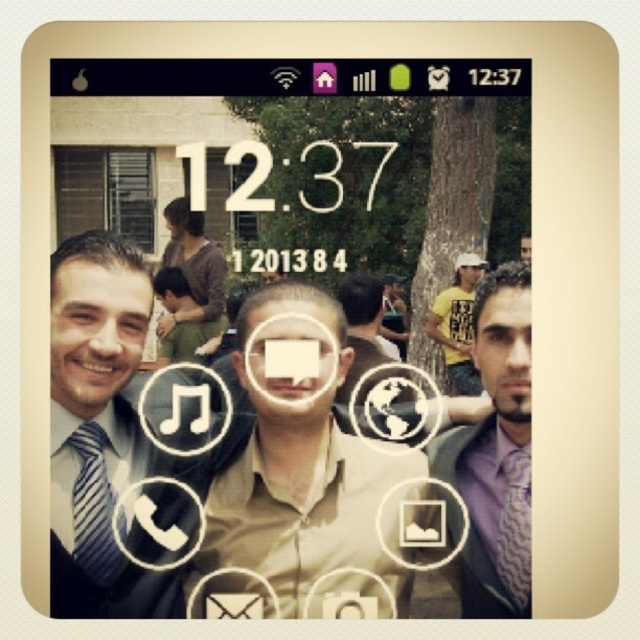
You are designing a digital collage and need to adjust the layout so that the smooth skin face at center is the same height as the matte black face at left. Which face should you enlarge or shrink, and by what percentage?

The smooth skin face at center is shorter than the matte black face at left. To make them the same height, you should enlarge the smooth skin face at center by the percentage difference between their heights. However, the exact percentage cannot be calculated without knowing the current height measurements.

You are a photographer trying to capture a closeup of the purple silk shirt at right and the matte black face at left in the smartphone screen image. Based on their sizes, which object would appear more prominent in your photo?

The purple silk shirt at right appears more prominent in the photo because it has a larger size compared to the matte black face at left.